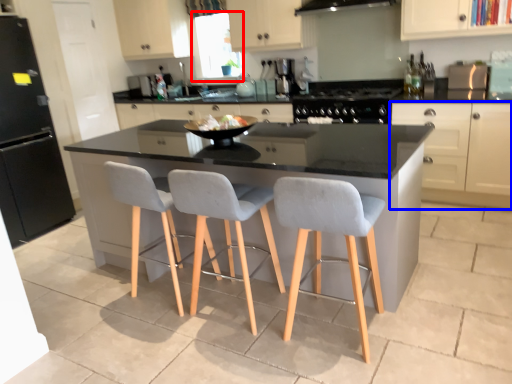
Question: Which of the following is the farthest to the observer, window screen (highlighted by a red box) or cabinetry (highlighted by a blue box)?

Choices:
 (A) window screen
 (B) cabinetry

Answer: (A)